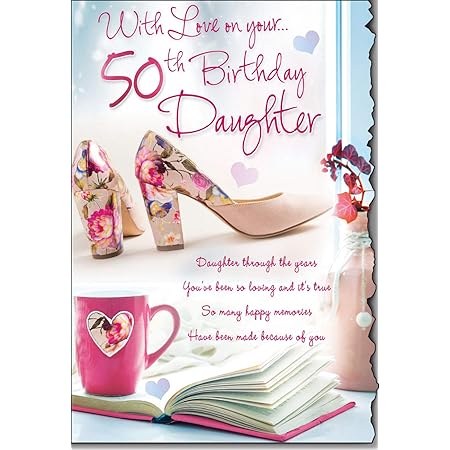
At what (x,y) coordinates should I click in order to perform the action: click on pink handle on cup. Please return your answer as a coordinate pair (x, y). Looking at the image, I should click on (155, 310).